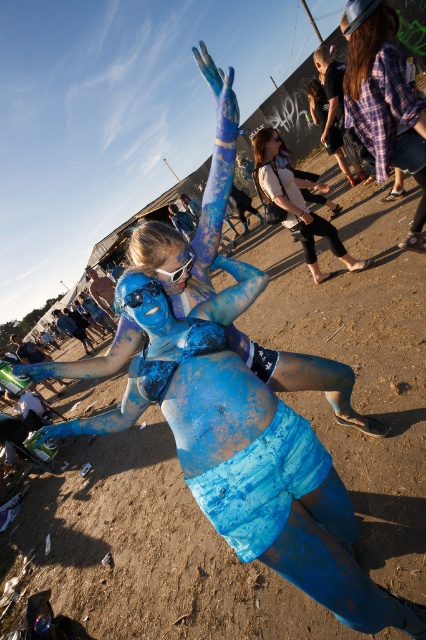
Looking at this image, you are a photographer at the festival and want to take a photo of the white textured shirt at center and the matte blue camera at center. Which object will appear larger in your photo?

The white textured shirt at center will appear larger in the photo because it is closer to the viewer than the matte blue camera at center.